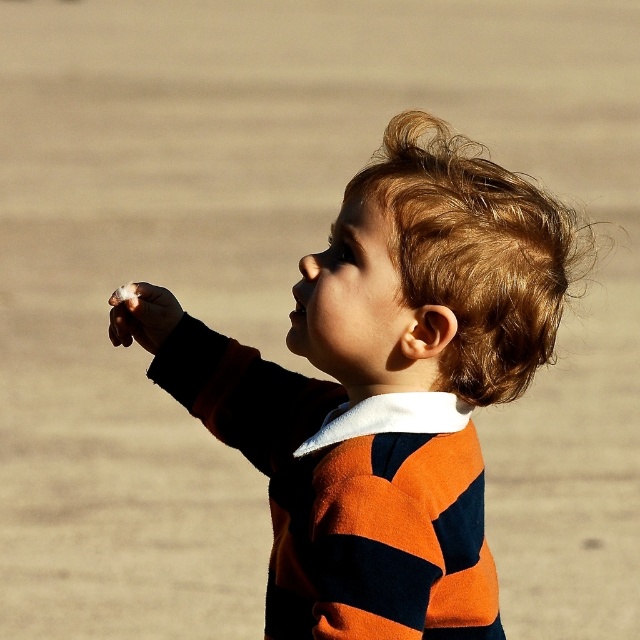
You are a photographer trying to capture the child in the image. You want to ensure both the striped sweater at center and the white cotton candy at lower left are visible in the frame. Which object should you focus on to include both in the shot?

You should focus on the striped sweater at center since it is wider than the white cotton candy at lower left, making it easier to frame both objects by centering on the wider one.

You are a photographer trying to capture a closeup of the striped sweater at center and the white cotton candy at lower left. Based on their positions, which object should you focus on first to ensure both are in frame?

The striped sweater at center is positioned on the right side of white cotton candy at lower left, so you should focus on the white cotton candy at lower left first to ensure both are in frame.

The scene shows a child wearing a striped sweater at center and has blonde textured hair at upper right. Which object is bigger?

The striped sweater at center is larger in size than the blonde textured hair at upper right.